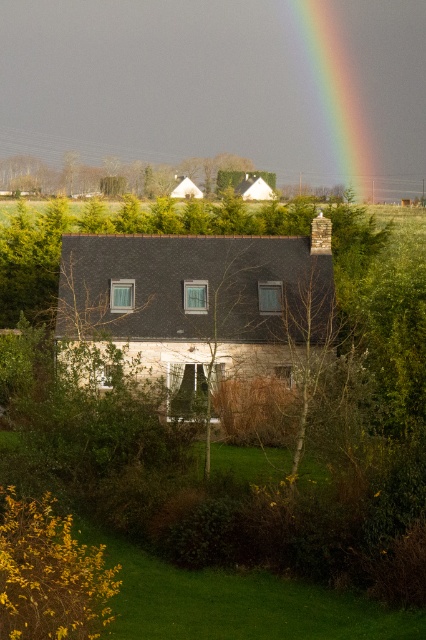
Is rainbow at upper center below green leafy tree at upper center?

Actually, rainbow at upper center is above green leafy tree at upper center.

Measure the distance from rainbow at upper center to green leafy tree at upper center.

rainbow at upper center and green leafy tree at upper center are 106.80 feet apart from each other.

Image resolution: width=426 pixels, height=640 pixels. What are the coordinates of `rainbow at upper center` in the screenshot? It's located at (333, 93).

In order to click on rainbow at upper center in this screenshot , I will do `click(333, 93)`.

Does bare branches at center appear on the right side of green leafy tree at upper center?

Correct, you'll find bare branches at center to the right of green leafy tree at upper center.

Image resolution: width=426 pixels, height=640 pixels. Find the location of `bare branches at center`. bare branches at center is located at coordinates (298, 328).

Between point (299, 257) and point (337, 116), which one is positioned behind?

Positioned behind is point (337, 116).

Can you confirm if bare branches at center is bigger than rainbow at upper center?

No, bare branches at center is not bigger than rainbow at upper center.

I want to click on bare branches at center, so click(298, 328).

Image resolution: width=426 pixels, height=640 pixels. I want to click on bare branches at center, so click(x=298, y=328).